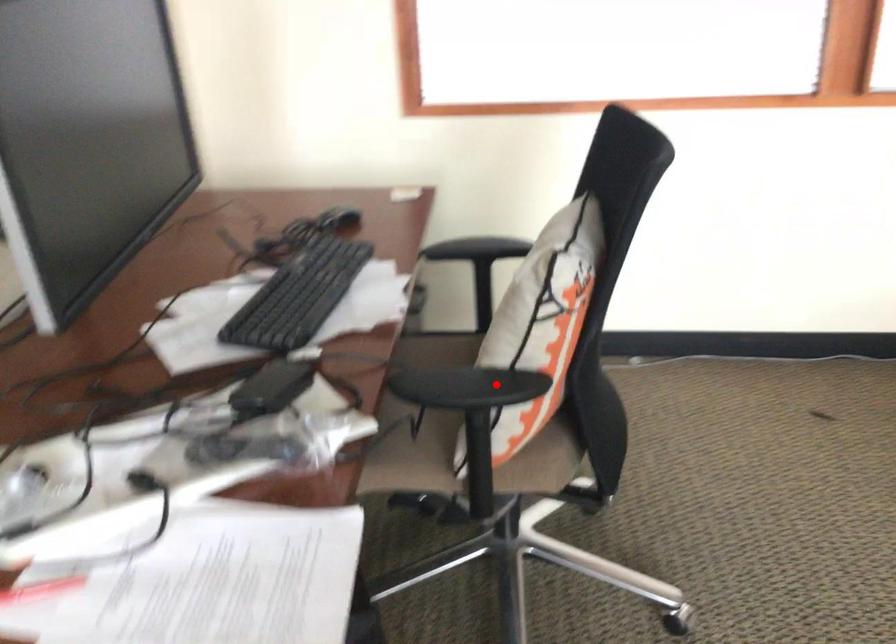
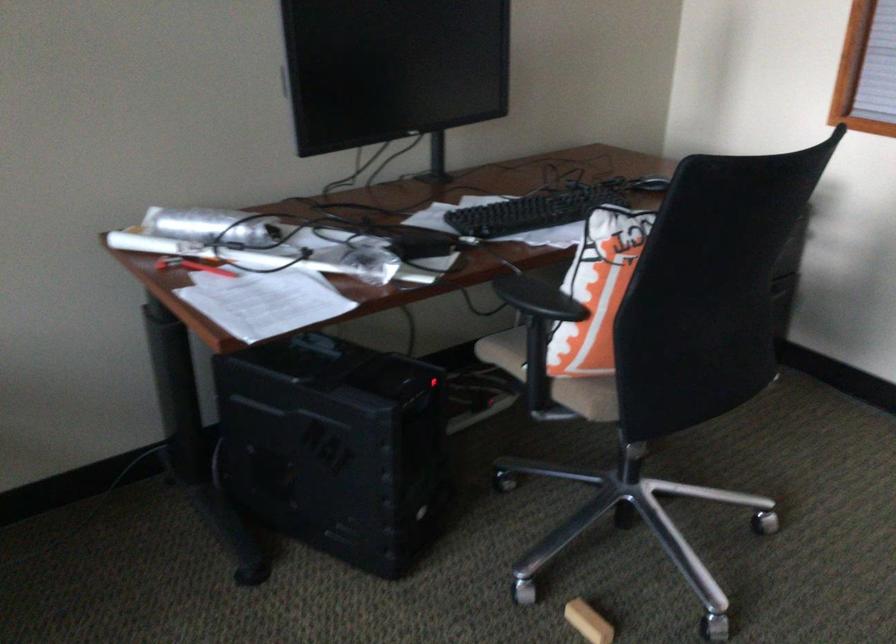
Question: A red point is marked in image1. In image2, is the corresponding 3D point closer to the camera or farther? Reply with the corresponding letter.

Choices:
 (A) The corresponding 3D point is closer.
 (B) The corresponding 3D point is farther.

Answer: (B)